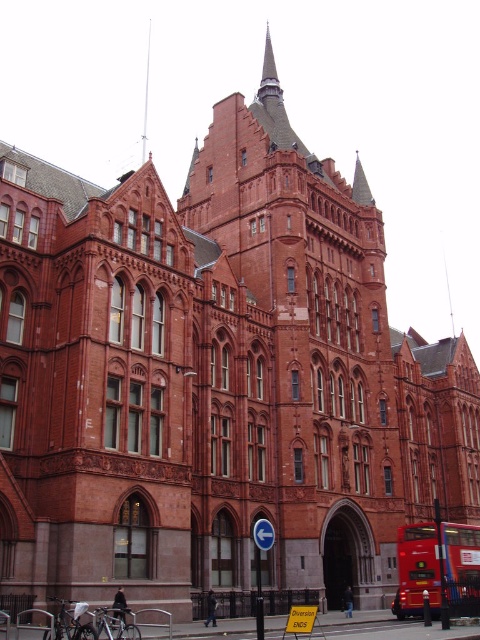
You are a tourist standing in front of the historic building and notice a red metallic bus at lower right and a smooth silver spire at upper center. Which object is closer to the ground?

The red metallic bus at lower right is closer to the ground because it is positioned under the smooth silver spire at upper center, which is higher up.

Consider the image. You are a photographer trying to capture the entire building and the red metallic bus at lower right in one shot. Given that the smooth silver spire at upper center is part of the building, which object would require you to adjust your camera angle more to include in the frame?

The red metallic bus at lower right would require adjusting the camera angle more because its width surpasses that of the smooth silver spire at upper center, making it harder to fit into the frame while capturing the entire building.

You are standing in front of the historic building and see the red metallic bus at lower right and the smooth silver spire at upper center. Which object is located to the right of the other?

The red metallic bus at lower right is positioned on the right side of smooth silver spire at upper center.